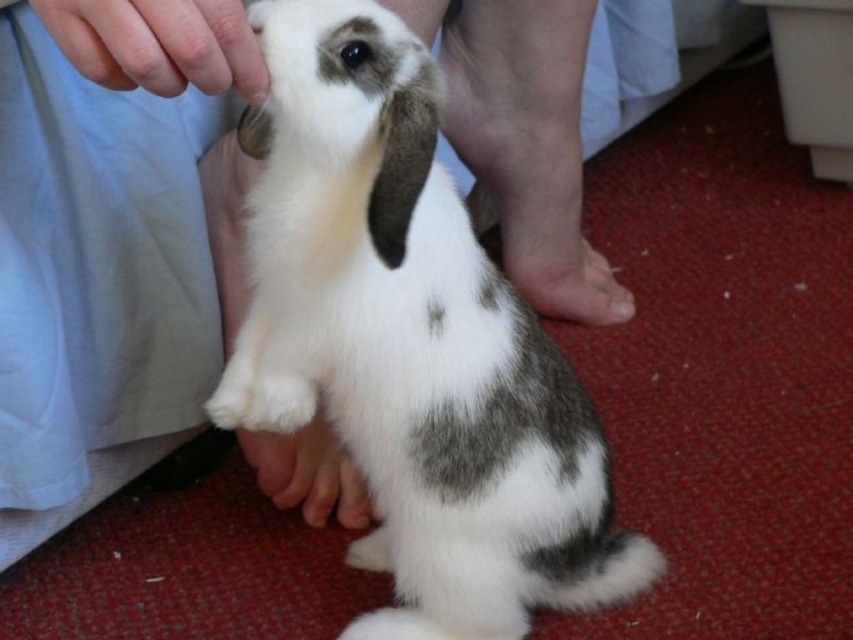
Is point (228, 1) closer to camera compared to point (221, 198)?

Yes.

Where is `smooth skin at upper left`? This screenshot has height=640, width=853. smooth skin at upper left is located at coordinates (158, 44).

This screenshot has width=853, height=640. Identify the location of smooth skin at upper left. (158, 44).

Is point (432, 291) closer to viewer compared to point (329, 500)?

Yes.

Is point (425, 241) farther from viewer compared to point (223, 333)?

No.

The width and height of the screenshot is (853, 640). Find the location of `white-spotted fur rabbit at center`. white-spotted fur rabbit at center is located at coordinates (410, 342).

Is smooth skin at upper left wider than white fur paw at lower center?

No.

Is smooth skin at upper left positioned at the back of white fur paw at lower center?

That is False.

Does point (184, 22) lie behind point (550, 240)?

That is False.

Locate an element on the screen. Image resolution: width=853 pixels, height=640 pixels. smooth skin at upper left is located at coordinates (158, 44).